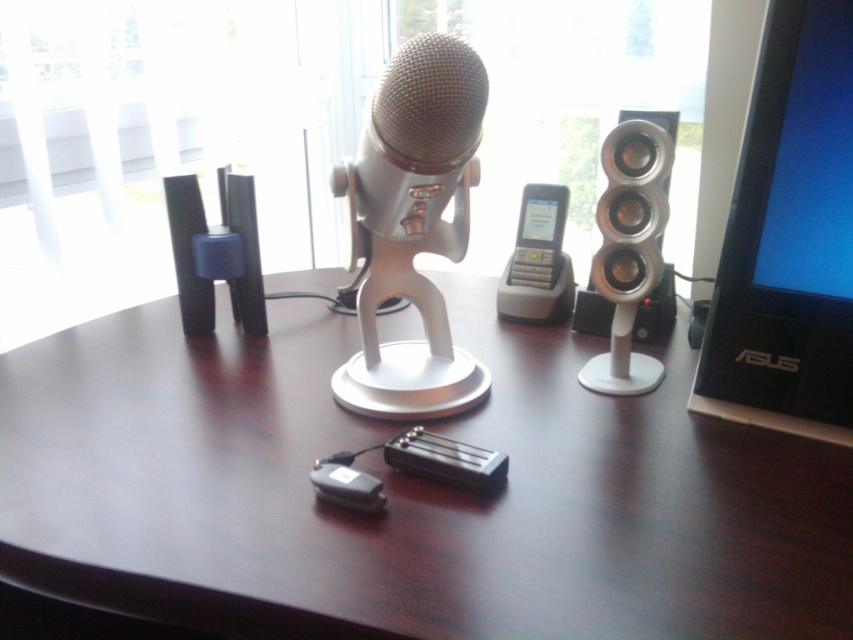
Question: Considering the real-world distances, which object is farthest from the silver metallic microphone at center?

Choices:
 (A) dark wood table at center
 (B) black plastic speaker at left
 (C) silver metallic speaker at right

Answer: (B)

Question: Which point is closer to the camera?

Choices:
 (A) (631, 150)
 (B) (212, 314)
 (C) (834, 38)

Answer: (C)

Question: Does dark wood table at center appear over silver metallic microphone at center?

Choices:
 (A) yes
 (B) no

Answer: (B)

Question: Is dark wood table at center positioned before black plastic monitor at upper right?

Choices:
 (A) yes
 (B) no

Answer: (A)

Question: Which of the following is the closest to the observer?

Choices:
 (A) (653, 253)
 (B) (173, 237)
 (C) (453, 205)

Answer: (A)

Question: Is black plastic monitor at upper right to the right of silver metallic speaker at right from the viewer's perspective?

Choices:
 (A) no
 (B) yes

Answer: (B)